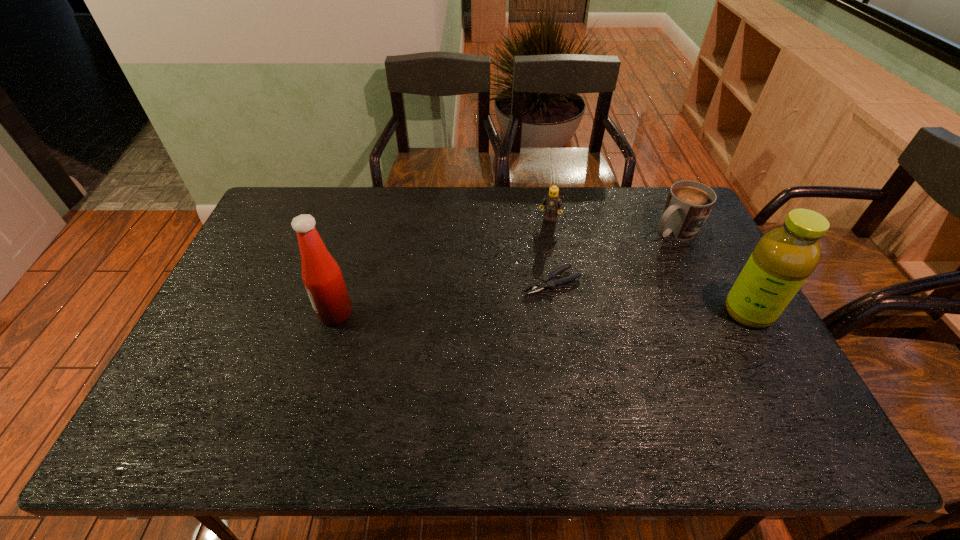
The height and width of the screenshot is (540, 960). Identify the location of vacant area that satisfies the following two spatial constraints: 1. on the front side of the fruit juice; 2. on the front label of the pliers. (557, 312).

You are a GUI agent. You are given a task and a screenshot of the screen. Output one action in this format:
    pyautogui.click(x=<x>, y=<y>)
    Task: Click on the free space in the image that satisfies the following two spatial constraints: 1. on the front side of the Lego; 2. on the front label of the fruit juice
    Image resolution: width=960 pixels, height=540 pixels.
    Given the screenshot: What is the action you would take?
    pyautogui.click(x=565, y=312)

You are a GUI agent. You are given a task and a screenshot of the screen. Output one action in this format:
    pyautogui.click(x=<x>, y=<y>)
    Task: Click on the free location that satisfies the following two spatial constraints: 1. on the front side of the fruit juice; 2. on the front label of the shortest object
    The width and height of the screenshot is (960, 540).
    Given the screenshot: What is the action you would take?
    pyautogui.click(x=557, y=312)